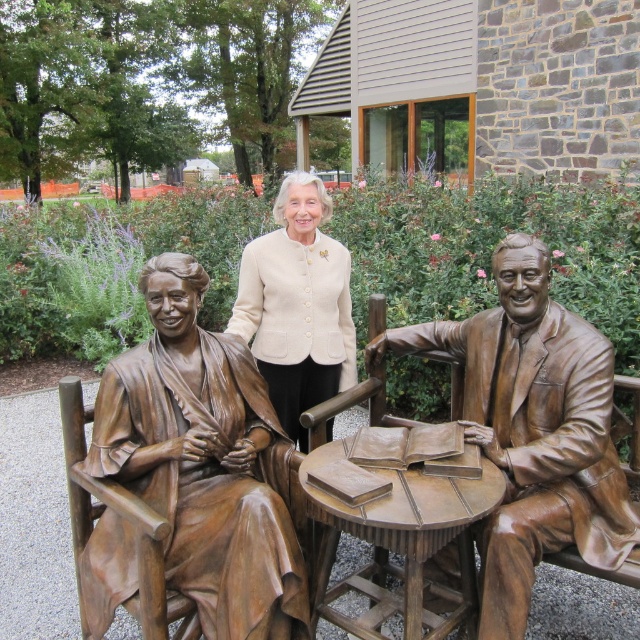
Can you confirm if bronze statue at left is positioned to the left of bronze textured table at center?

Yes, bronze statue at left is to the left of bronze textured table at center.

Between point (275, 454) and point (440, 637), which one is positioned in front?

Point (440, 637)

Measure the distance between bronze statue at left and camera.

bronze statue at left and camera are 1.98 meters apart.

The width and height of the screenshot is (640, 640). Identify the location of bronze statue at left. (204, 461).

Is point (99, 576) in front of point (483, 250)?

Yes, it is.

Is point (205, 458) positioned in front of point (474, 220)?

Yes.

The width and height of the screenshot is (640, 640). I want to click on bronze statue at left, so click(204, 461).

Does bronze textured table at center have a smaller size compared to beige woolen jacket at center?

Correct, bronze textured table at center occupies less space than beige woolen jacket at center.

Between point (438, 496) and point (301, 410), which one is positioned behind?

Positioned behind is point (301, 410).

Between point (406, 584) and point (276, 273), which one is positioned in front?

Positioned in front is point (406, 584).

At what (x,y) coordinates should I click in order to perform the action: click on bronze textured table at center. Please return your answer as a coordinate pair (x, y). The width and height of the screenshot is (640, 640). Looking at the image, I should click on (397, 520).